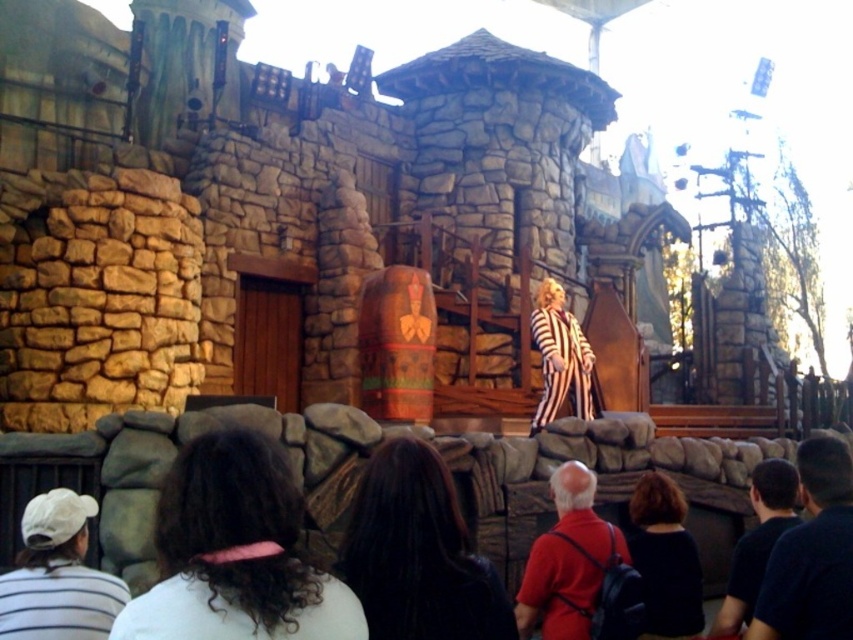
Between white cotton cap at lower left and matte red shirt at center, which one has less height?

white cotton cap at lower left

Is white cotton cap at lower left below matte red shirt at center?

No.

You are a GUI agent. You are given a task and a screenshot of the screen. Output one action in this format:
    pyautogui.click(x=<x>, y=<y>)
    Task: Click on the white cotton cap at lower left
    The image size is (853, 640).
    Given the screenshot: What is the action you would take?
    pyautogui.click(x=57, y=576)

You are a GUI agent. You are given a task and a screenshot of the screen. Output one action in this format:
    pyautogui.click(x=<x>, y=<y>)
    Task: Click on the white cotton cap at lower left
    This screenshot has width=853, height=640.
    Given the screenshot: What is the action you would take?
    pyautogui.click(x=57, y=576)

Is matte red shirt at center smaller than dark blue shirt at lower right?

Correct, matte red shirt at center occupies less space than dark blue shirt at lower right.

Measure the distance between matte red shirt at center and camera.

They are 114.72 feet apart.

Identify the location of matte red shirt at center. Image resolution: width=853 pixels, height=640 pixels. (556, 589).

The image size is (853, 640). In order to click on matte red shirt at center in this screenshot , I will do tap(556, 589).

Can you confirm if white cotton cap at lower left is wider than dark blue shirt at lower right?

No, white cotton cap at lower left is not wider than dark blue shirt at lower right.

Is white cotton cap at lower left smaller than dark blue shirt at lower right?

Yes.

Who is more distant from viewer, (15, 588) or (740, 563)?

The point (740, 563) is behind.

The image size is (853, 640). Identify the location of white cotton cap at lower left. [57, 576].